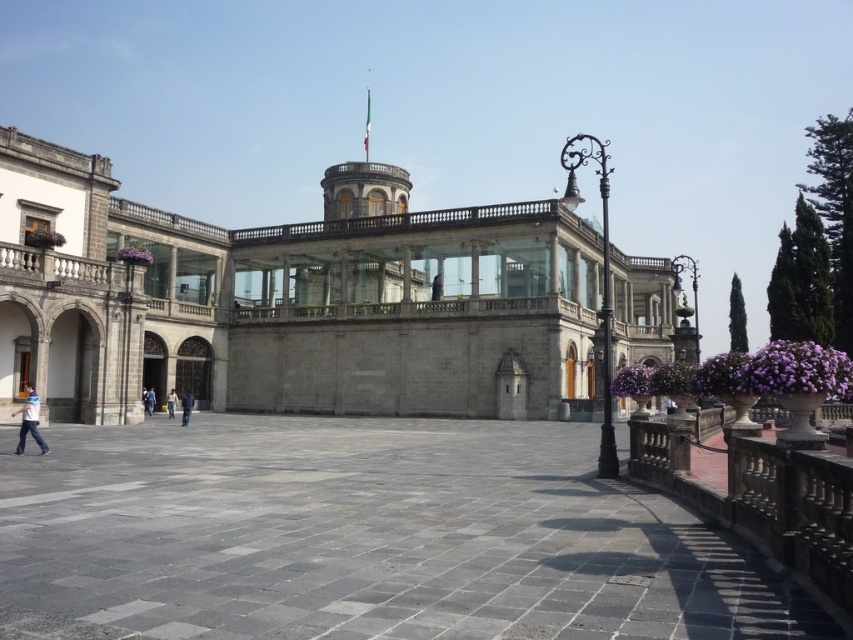
Question: Does gray stone courtyard at center appear under blue jeans at center?

Choices:
 (A) no
 (B) yes

Answer: (B)

Question: Which point is farther from the camera taking this photo?

Choices:
 (A) (148, 413)
 (B) (173, 397)
 (C) (408, 284)

Answer: (C)

Question: Is gray stone courtyard at center wider than light blue jeans at lower left?

Choices:
 (A) yes
 (B) no

Answer: (A)

Question: Which object is positioned closest to the light blue jeans at lower left?

Choices:
 (A) blue jeans at center
 (B) gray stone building at center
 (C) blue fabric jacket at lower left
 (D) gray stone courtyard at center

Answer: (D)

Question: Does light blue jeans at lower left have a lesser width compared to light blue jeans at center?

Choices:
 (A) yes
 (B) no

Answer: (B)

Question: Which of the following is the farthest from the observer?

Choices:
 (A) (364, 291)
 (B) (349, 529)
 (C) (20, 448)

Answer: (A)